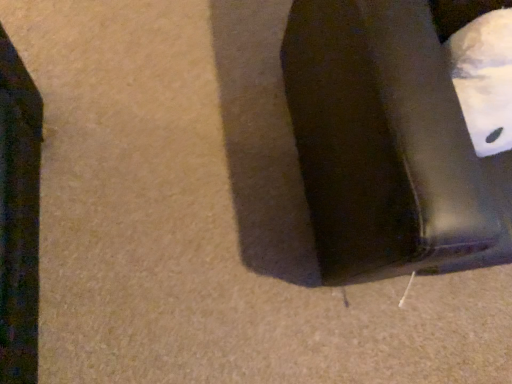
Locate an element on the screen. This screenshot has width=512, height=384. black leather couch at right is located at coordinates (388, 145).

Measure the distance between point [420,12] and camera.

Point [420,12] is 32.72 inches away from camera.

Describe the element at coordinates (388, 145) in the screenshot. I see `black leather couch at right` at that location.

Identify the location of black leather couch at right. Image resolution: width=512 pixels, height=384 pixels. (388, 145).